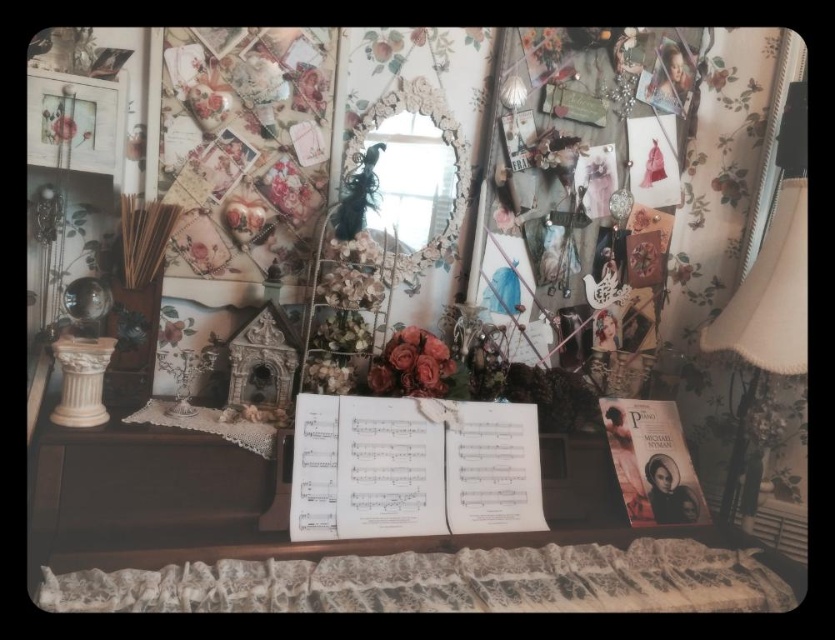
You are arranging a display on a shelf and need to know which object takes up more horizontal space. Which is wider, the matte white picture frame at upper left or the matte pink flower at upper left?

The matte white picture frame at upper left might be wider than matte pink flower at upper left, so it could take up more horizontal space.

You are arranging flowers in a vase. The wooden table at center and the beige fabric lampshade at right are both in the room. Which object should you place the vase on if you want it closer to the left wall?

You should place the vase on the wooden table at center because it is to the left of the beige fabric lampshade at right, making it closer to the left wall.